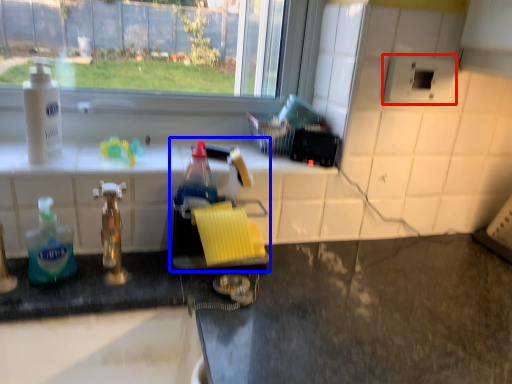
Question: Which point is further to the camera, appliance (highlighted by a red box) or sink (highlighted by a blue box)?

Choices:
 (A) appliance
 (B) sink

Answer: (A)